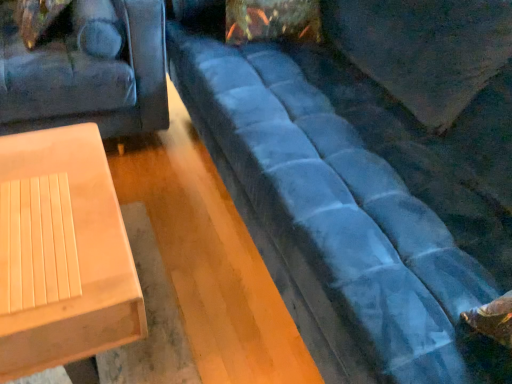
Measure the distance between point (450, 44) and camera.

4.17 feet.

The image size is (512, 384). Identify the location of velvet blue couch at center. (368, 176).

The image size is (512, 384). Describe the element at coordinates (368, 176) in the screenshot. I see `velvet blue couch at center` at that location.

In order to click on light wood/texture table at lower left in this screenshot , I will do `click(77, 260)`.

Describe the element at coordinates (77, 260) in the screenshot. Image resolution: width=512 pixels, height=384 pixels. I see `light wood/texture table at lower left` at that location.

In order to face light wood/texture table at lower left, should I rotate leftwards or rightwards?

Turn left by 25.530 degrees to look at light wood/texture table at lower left.

Where is `velvet blue couch at center`? This screenshot has height=384, width=512. velvet blue couch at center is located at coordinates (368, 176).

Does velvet blue couch at center appear on the right side of light wood/texture table at lower left?

Indeed, velvet blue couch at center is positioned on the right side of light wood/texture table at lower left.

Is velvet blue couch at center behind light wood/texture table at lower left?

No, velvet blue couch at center is closer to the viewer.

Is point (220, 110) closer or farther from the camera than point (87, 180)?

Point (220, 110) is farther from the camera than point (87, 180).

From the image's perspective, is velvet blue couch at center on top of light wood/texture table at lower left?

Yes.

From a real-world perspective, between velvet blue couch at center and light wood/texture table at lower left, who is vertically lower?

In real-world perspective, light wood/texture table at lower left is lower.

Considering the sizes of objects velvet blue couch at center and light wood/texture table at lower left in the image provided, who is thinner, velvet blue couch at center or light wood/texture table at lower left?

Thinner between the two is light wood/texture table at lower left.

Consider the image. In terms of height, does velvet blue couch at center look taller or shorter compared to light wood/texture table at lower left?

Clearly, velvet blue couch at center is taller compared to light wood/texture table at lower left.

Based on the photo, considering the sizes of objects velvet blue couch at center and light wood/texture table at lower left in the image provided, who is bigger, velvet blue couch at center or light wood/texture table at lower left?

Bigger between the two is velvet blue couch at center.

From the picture: Is velvet blue couch at center outside of light wood/texture table at lower left?

velvet blue couch at center lies outside light wood/texture table at lower left's area.

Is velvet blue couch at center placed right next to light wood/texture table at lower left?

velvet blue couch at center and light wood/texture table at lower left are clearly separated.

In the scene shown: Could you tell me if velvet blue couch at center is turned towards light wood/texture table at lower left?

Yes, velvet blue couch at center is facing light wood/texture table at lower left.

Can you tell me how much velvet blue couch at center and light wood/texture table at lower left differ in facing direction?

90.2 degrees.

How far apart are velvet blue couch at center and light wood/texture table at lower left?

A distance of 25.02 inches exists between velvet blue couch at center and light wood/texture table at lower left.

This screenshot has width=512, height=384. I want to click on table directly beneath the velvet blue couch at center (from a real-world perspective), so click(x=77, y=260).

Considering the relative positions of light wood/texture table at lower left and velvet blue couch at center in the image provided, is light wood/texture table at lower left to the left of velvet blue couch at center from the viewer's perspective?

Indeed, light wood/texture table at lower left is positioned on the left side of velvet blue couch at center.

From the picture: Relative to velvet blue couch at center, is light wood/texture table at lower left in front or behind?

light wood/texture table at lower left is positioned farther from the viewer than velvet blue couch at center.

Which is behind, point (104, 198) or point (302, 315)?

Positioned behind is point (302, 315).

From the image's perspective, which object appears higher, light wood/texture table at lower left or velvet blue couch at center?

velvet blue couch at center.

From a real-world perspective, is light wood/texture table at lower left physically below velvet blue couch at center?

Indeed, from a real-world perspective, light wood/texture table at lower left is positioned beneath velvet blue couch at center.

From the picture: Is light wood/texture table at lower left wider than velvet blue couch at center?

In fact, light wood/texture table at lower left might be narrower than velvet blue couch at center.

Considering the relative sizes of light wood/texture table at lower left and velvet blue couch at center in the image provided, is light wood/texture table at lower left shorter than velvet blue couch at center?

Yes, light wood/texture table at lower left is shorter than velvet blue couch at center.

Can you confirm if light wood/texture table at lower left is smaller than velvet blue couch at center?

Yes.

Could velvet blue couch at center be considered to be inside light wood/texture table at lower left?

No, velvet blue couch at center is not inside light wood/texture table at lower left.

Is light wood/texture table at lower left not near velvet blue couch at center?

No, there isn't a large distance between light wood/texture table at lower left and velvet blue couch at center.

Based on the photo, is light wood/texture table at lower left facing away from velvet blue couch at center?

No, light wood/texture table at lower left is not facing the opposite direction of velvet blue couch at center.

How many degrees apart are the facing directions of light wood/texture table at lower left and velvet blue couch at center?

90.2 degrees separate the facing orientations of light wood/texture table at lower left and velvet blue couch at center.

How much distance is there between light wood/texture table at lower left and velvet blue couch at center?

light wood/texture table at lower left is 25.02 inches away from velvet blue couch at center.

Image resolution: width=512 pixels, height=384 pixels. Find the location of `studio couch positioned vertically above the light wood/texture table at lower left (from a real-world perspective)`. studio couch positioned vertically above the light wood/texture table at lower left (from a real-world perspective) is located at coordinates (368, 176).

Find the location of a particular element. studio couch above the light wood/texture table at lower left (from the image's perspective) is located at coordinates (368, 176).

This screenshot has height=384, width=512. Identify the location of studio couch to the right of light wood/texture table at lower left. (368, 176).